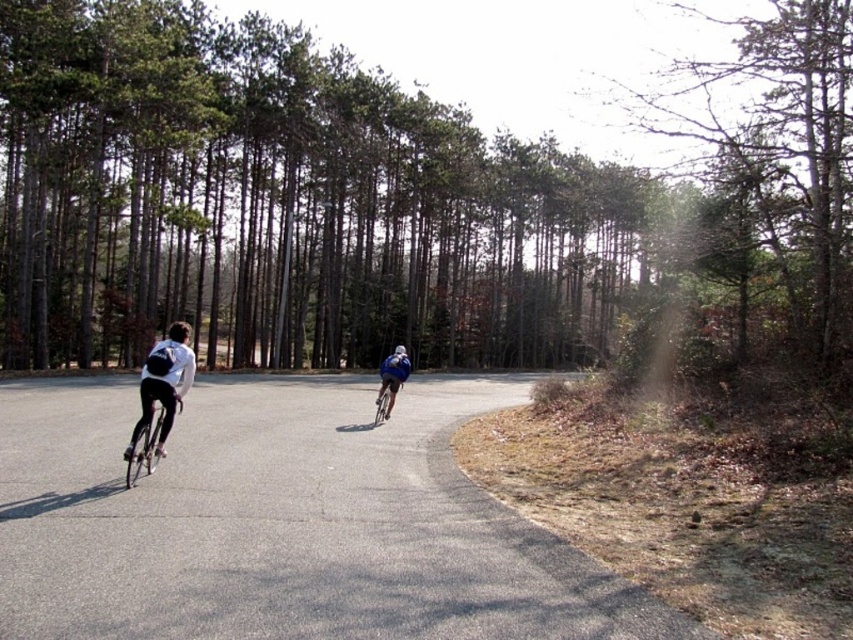
You are a photographer standing at the starting point of the road. You want to take a photo that includes both cyclists. Which cyclist, the one at point (131, 458) or the one at point (389, 364), is closer to you and should be positioned in the foreground of the photo?

The cyclist at point (131, 458) is closer to you because point (131, 458) is closer to the viewer than point (389, 364). This cyclist should be placed in the foreground of the photo.